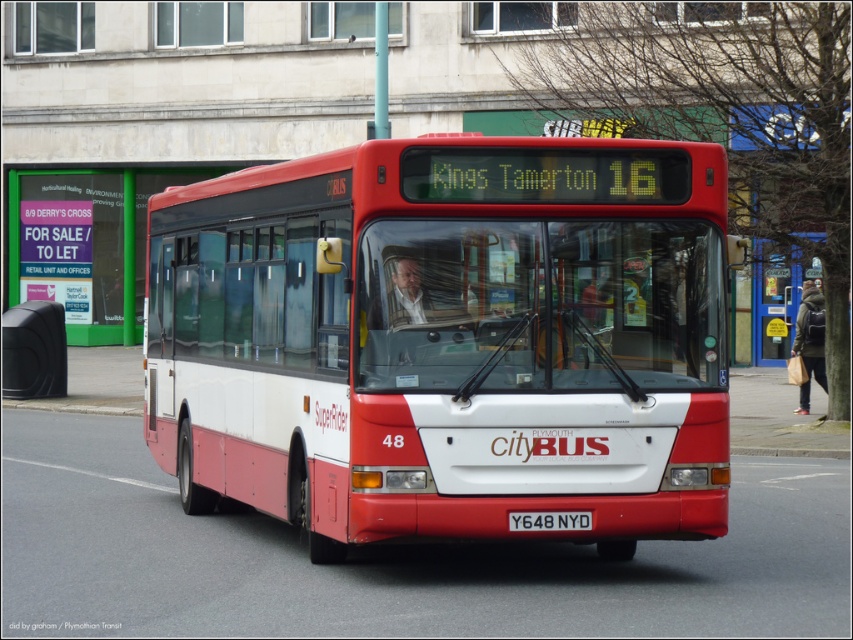
Question: Can you confirm if red matte bus at center is bigger than black metal license plate at center?

Choices:
 (A) yes
 (B) no

Answer: (A)

Question: Is matte black speaker at left to the left of black metal license plate at center from the viewer's perspective?

Choices:
 (A) yes
 (B) no

Answer: (A)

Question: Is red matte bus at center thinner than matte black speaker at left?

Choices:
 (A) yes
 (B) no

Answer: (A)

Question: Among these objects, which one is nearest to the camera?

Choices:
 (A) matte black speaker at left
 (B) black metal license plate at center
 (C) red matte bus at center

Answer: (C)

Question: Which point is farther to the camera?

Choices:
 (A) (50, 364)
 (B) (541, 516)

Answer: (A)

Question: Which point is farther to the camera?

Choices:
 (A) matte black speaker at left
 (B) black metal license plate at center
 (C) red matte bus at center

Answer: (A)